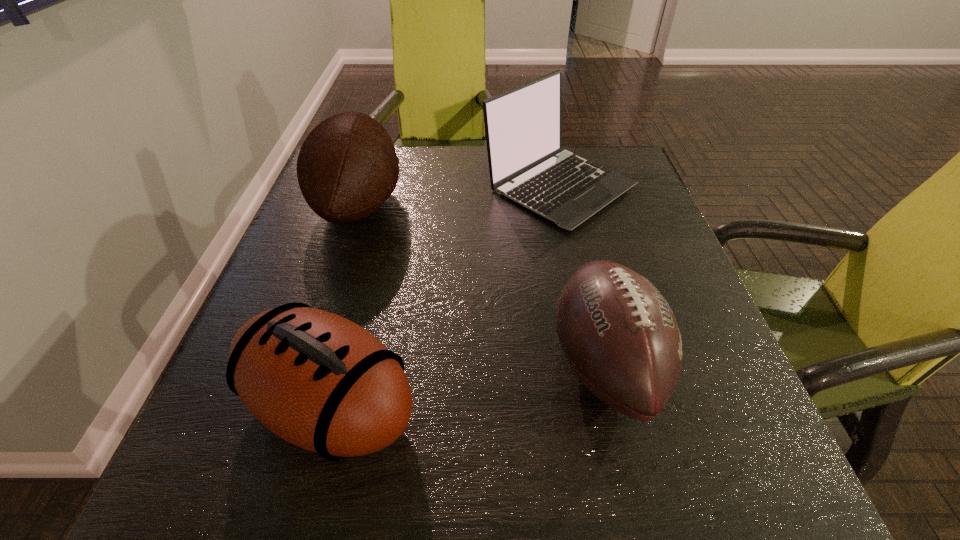
Locate an element on the screen. free space between the rightmost football (American) and the farthest football (American) is located at coordinates (482, 285).

The height and width of the screenshot is (540, 960). Identify the location of free area in between the laptop_computer and the farthest football (American). (459, 195).

Choose which object is the second nearest neighbor to the laptop_computer. Please provide its 2D coordinates. Your answer should be formatted as a tuple, i.e. [(x, y)], where the tuple contains the x and y coordinates of a point satisfying the conditions above.

[(619, 335)]

Choose which object is the second nearest neighbor to the farthest football (American). Please provide its 2D coordinates. Your answer should be formatted as a tuple, i.e. [(x, y)], where the tuple contains the x and y coordinates of a point satisfying the conditions above.

[(319, 381)]

Locate which football (American) ranks in proximity to the farthest football (American). Please provide its 2D coordinates. Your answer should be formatted as a tuple, i.e. [(x, y)], where the tuple contains the x and y coordinates of a point satisfying the conditions above.

[(319, 381)]

Choose which football (American) is the nearest neighbor to the farthest football (American). Please provide its 2D coordinates. Your answer should be formatted as a tuple, i.e. [(x, y)], where the tuple contains the x and y coordinates of a point satisfying the conditions above.

[(319, 381)]

This screenshot has width=960, height=540. I want to click on vacant area in the image that satisfies the following two spatial constraints: 1. on the back side of the rightmost football (American); 2. on the laces of the farthest football (American), so click(x=567, y=205).

Locate an element on the screen. This screenshot has width=960, height=540. vacant region that satisfies the following two spatial constraints: 1. on the laces of the farthest football (American); 2. on the back side of the rightmost football (American) is located at coordinates (306, 364).

This screenshot has height=540, width=960. What are the coordinates of `vacant region that satisfies the following two spatial constraints: 1. on the laces of the farthest football (American); 2. on the back side of the rightmost football (American)` in the screenshot? It's located at (306, 364).

Identify the location of free space that satisfies the following two spatial constraints: 1. at the front screen of the laptop_computer; 2. on the laces of the farthest football (American). (564, 205).